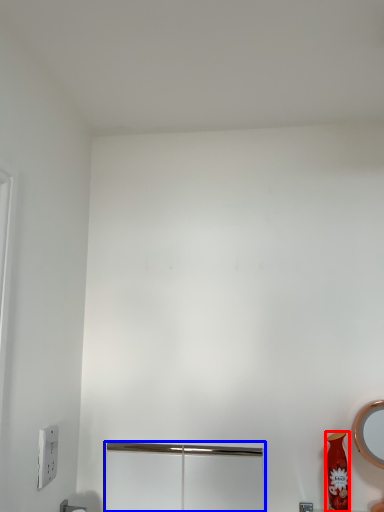
Question: Which object appears closest to the camera in this image, vase (highlighted by a red box) or screen door (highlighted by a blue box)?

Choices:
 (A) vase
 (B) screen door

Answer: (A)